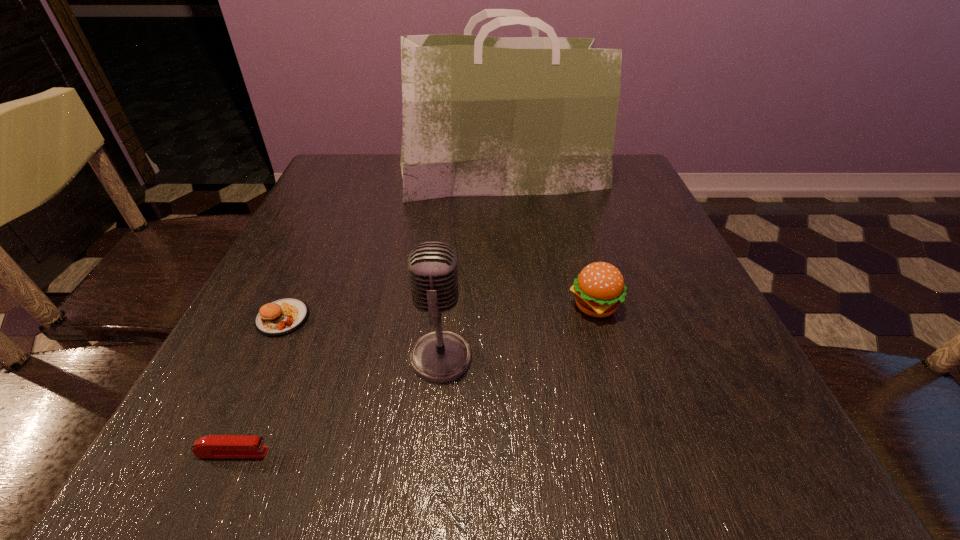
Locate an element on the screen. vacant area that lies between the shortest object and the third shortest object is located at coordinates (414, 380).

Image resolution: width=960 pixels, height=540 pixels. In order to click on vacant region between the grocery bag and the second shortest object in this screenshot , I will do [392, 247].

The width and height of the screenshot is (960, 540). I want to click on vacant area that lies between the fourth shortest object and the patty, so click(362, 338).

The width and height of the screenshot is (960, 540). I want to click on the fourth closest object to the tallest object, so click(x=212, y=446).

Point out which object is positioned as the nearest to the second shortest object. Please provide its 2D coordinates. Your answer should be formatted as a tuple, i.e. [(x, y)], where the tuple contains the x and y coordinates of a point satisfying the conditions above.

[(441, 356)]

You are a GUI agent. You are given a task and a screenshot of the screen. Output one action in this format:
    pyautogui.click(x=<x>, y=<y>)
    Task: Click on the free space that satisfies the following two spatial constraints: 1. on the back side of the microphone; 2. on the right side of the third tallest object
    
    Given the screenshot: What is the action you would take?
    pyautogui.click(x=445, y=306)

The width and height of the screenshot is (960, 540). Find the location of `free region that satisfies the following two spatial constraints: 1. on the front side of the hamburger; 2. on the front-facing side of the shortest object`. free region that satisfies the following two spatial constraints: 1. on the front side of the hamburger; 2. on the front-facing side of the shortest object is located at coordinates (636, 453).

You are a GUI agent. You are given a task and a screenshot of the screen. Output one action in this format:
    pyautogui.click(x=<x>, y=<y>)
    Task: Click on the free space that satisfies the following two spatial constraints: 1. on the front side of the tallest object; 2. on the left side of the third shortest object
    
    Given the screenshot: What is the action you would take?
    point(512,306)